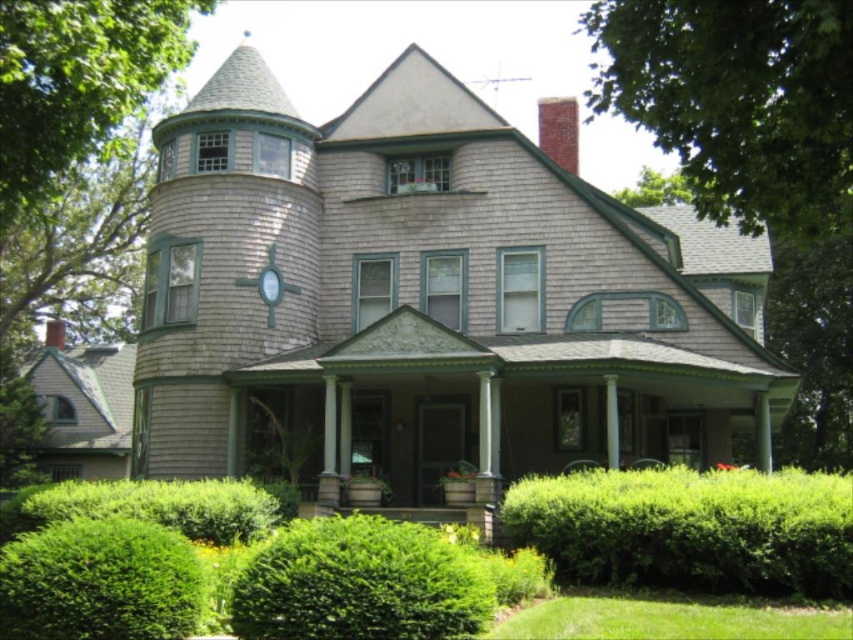
Question: Estimate the real-world distances between objects in this image. Which object is closer to the green leafy tree at upper left?

Choices:
 (A) green leafy hedge at lower right
 (B) green leafy tree at upper right

Answer: (A)

Question: Is green leafy hedge at lower center bigger than green grass at lower right?

Choices:
 (A) no
 (B) yes

Answer: (B)

Question: Does green leafy hedge at lower right lie behind green grass at lower right?

Choices:
 (A) no
 (B) yes

Answer: (B)

Question: Which object appears closest to the camera in this image?

Choices:
 (A) green leafy tree at upper left
 (B) green leafy hedge at lower left

Answer: (B)

Question: Estimate the real-world distances between objects in this image. Which object is farther from the green leafy hedge at lower right?

Choices:
 (A) green leafy hedge at lower left
 (B) green shingles at upper left
 (C) green leafy tree at upper left

Answer: (C)

Question: Is green shingles at upper left further to the viewer compared to green grass at lower right?

Choices:
 (A) no
 (B) yes

Answer: (B)